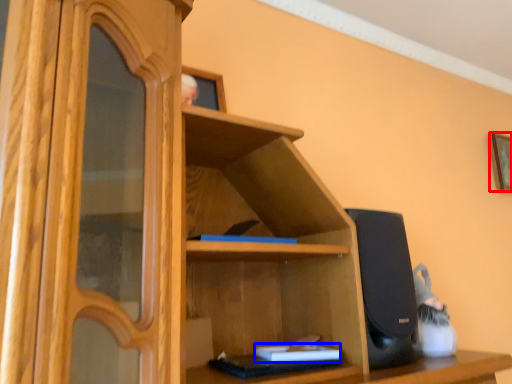
Question: Among these objects, which one is nearest to the camera, picture frame (highlighted by a red box) or book (highlighted by a blue box)?

Choices:
 (A) picture frame
 (B) book

Answer: (B)